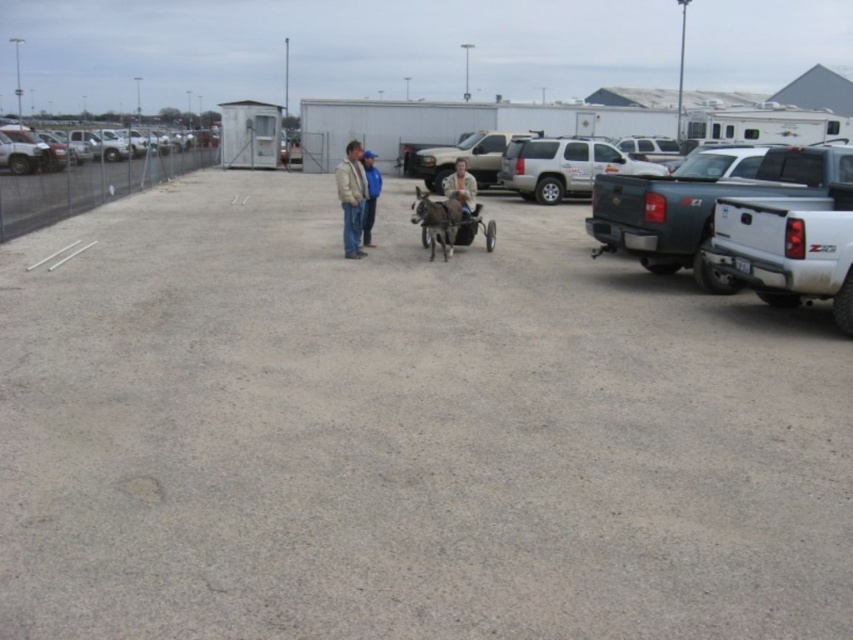
Based on the photo, is tan leather jacket at center below blue denim jacket at center?

Incorrect, tan leather jacket at center is not positioned below blue denim jacket at center.

Where is `tan leather jacket at center`? The height and width of the screenshot is (640, 853). tan leather jacket at center is located at coordinates (352, 198).

Which is more to the left, blue denim jacket at center or metallic silver cart at center?

blue denim jacket at center is more to the left.

Does point (366, 237) lie in front of point (486, 232)?

No.

The image size is (853, 640). What do you see at coordinates (370, 195) in the screenshot?
I see `blue denim jacket at center` at bounding box center [370, 195].

What are the coordinates of `blue denim jacket at center` in the screenshot? It's located at tap(370, 195).

Which of these two, tan leather jacket at center or metallic silver cart at center, stands shorter?

metallic silver cart at center is shorter.

How distant is tan leather jacket at center from metallic silver cart at center?

tan leather jacket at center is 8.30 feet away from metallic silver cart at center.

Who is more distant from viewer, [354,232] or [461,234]?

The point [461,234] is more distant.

Locate an element on the screen. tan leather jacket at center is located at coordinates (352, 198).